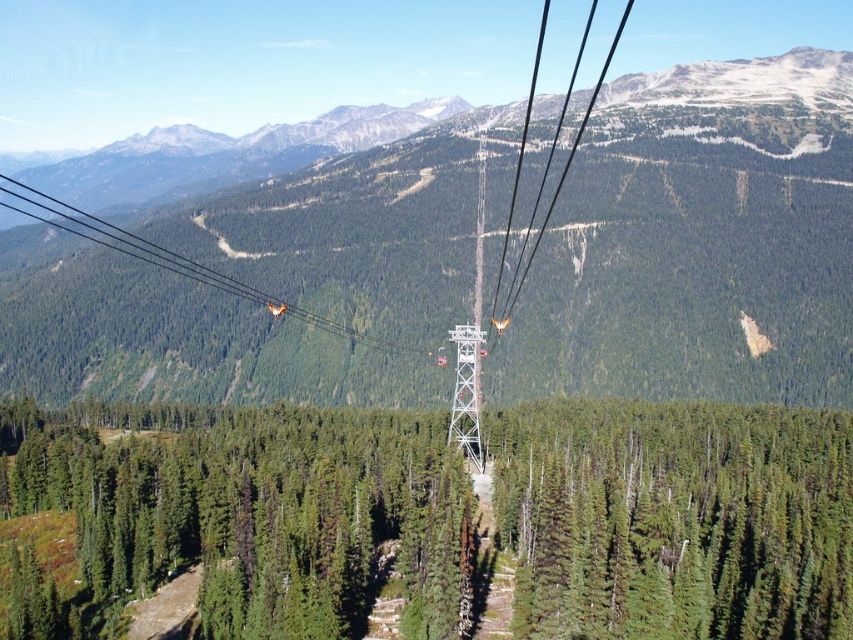
Does green matte pine forest at center have a greater height compared to white metallic tower at center?

No, green matte pine forest at center is not taller than white metallic tower at center.

Does point (366, 486) come in front of point (485, 339)?

That is True.

You are a GUI agent. You are given a task and a screenshot of the screen. Output one action in this format:
    pyautogui.click(x=<x>, y=<y>)
    Task: Click on the green matte pine forest at center
    The image size is (853, 640).
    Given the screenshot: What is the action you would take?
    pyautogui.click(x=253, y=509)

Is green matte tree at center above white metallic tower at center?

No.

Between green matte tree at center and white metallic tower at center, which one appears on the left side from the viewer's perspective?

green matte tree at center

Image resolution: width=853 pixels, height=640 pixels. Describe the element at coordinates (675, 518) in the screenshot. I see `green matte tree at center` at that location.

The height and width of the screenshot is (640, 853). Find the location of `green matte tree at center`. green matte tree at center is located at coordinates (675, 518).

Based on the photo, does green matte pine forest at center appear under green matte tree at center?

Indeed, green matte pine forest at center is positioned under green matte tree at center.

Can you confirm if green matte pine forest at center is positioned to the left of green matte tree at center?

Indeed, green matte pine forest at center is positioned on the left side of green matte tree at center.

Who is more forward, (798,620) or (601,627)?

Positioned in front is point (798,620).

The image size is (853, 640). In order to click on green matte pine forest at center in this screenshot , I will do click(x=253, y=509).